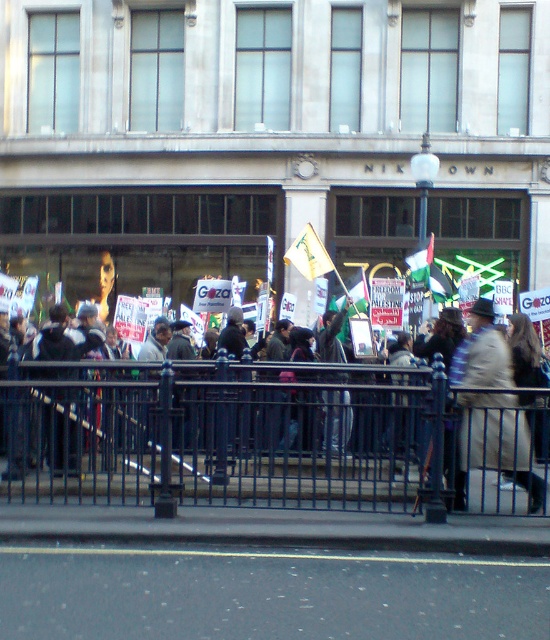
You are standing in the protest scene and want to take a photo. There are two points marked in the image. Which point, point (28, 454) or point (94, 317), is closer to you?

Point (28, 454) is closer to you than point (94, 317).

You are a photographer standing at the point labeled as point (266, 436). You want to capture a photo of the Nikown building entrance. Is the black metal fence at center blocking your view of the entrance?

The point (266, 436) indicates the black metal fence at center, so the fence is directly in front of you and blocking your view of the Nikown building entrance.

You are a photographer trying to capture a clear shot of the light brown leather coat at center without the black metal fence at center blocking the view. Is it possible to do so given their sizes?

The black metal fence at center has a larger size compared to light brown leather coat at center, so it might block the view. To capture a clear shot, you need to move closer to the light brown leather coat at center to avoid the larger fence obstructing it.